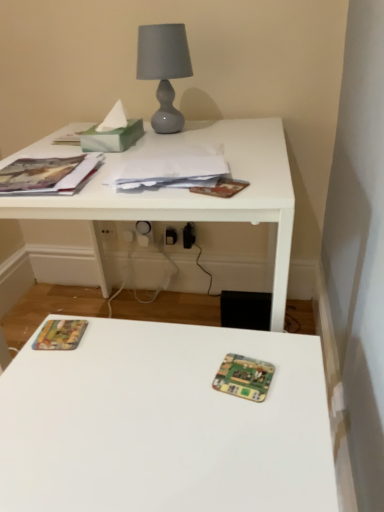
Question: Should I look upward or downward to see white glossy table at upper center?

Choices:
 (A) down
 (B) up

Answer: (A)

Question: Is the position of matte paper book at upper left, the second paperback book from the bottom, more distant than that of white glossy table at upper center?

Choices:
 (A) no
 (B) yes

Answer: (B)

Question: Is matte paper book at upper left, marked as the first paperback book in a top-to-bottom arrangement, oriented away from white glossy table at upper center?

Choices:
 (A) yes
 (B) no

Answer: (B)

Question: Is white glossy table at upper center surrounded by matte paper book at upper left, marked as the first paperback book in a top-to-bottom arrangement?

Choices:
 (A) no
 (B) yes

Answer: (A)

Question: From a real-world perspective, is matte paper book at upper left, marked as the first paperback book in a top-to-bottom arrangement, physically below white glossy table at upper center?

Choices:
 (A) no
 (B) yes

Answer: (A)

Question: Can you confirm if matte paper book at upper left, marked as the first paperback book in a top-to-bottom arrangement, is bigger than white glossy table at upper center?

Choices:
 (A) no
 (B) yes

Answer: (A)

Question: From a real-world perspective, is matte paper book at upper left, marked as the first paperback book in a top-to-bottom arrangement, physically above white glossy table at upper center?

Choices:
 (A) no
 (B) yes

Answer: (B)

Question: Is matte gray glass table lamp at upper center smaller than white paper at center?

Choices:
 (A) no
 (B) yes

Answer: (A)

Question: Does matte gray glass table lamp at upper center have a greater width compared to white paper at center?

Choices:
 (A) yes
 (B) no

Answer: (B)

Question: Considering the relative sizes of matte gray glass table lamp at upper center and white paper at center in the image provided, is matte gray glass table lamp at upper center shorter than white paper at center?

Choices:
 (A) no
 (B) yes

Answer: (A)

Question: Is matte gray glass table lamp at upper center aimed at white paper at center?

Choices:
 (A) no
 (B) yes

Answer: (B)

Question: Is white paper at center inside matte gray glass table lamp at upper center?

Choices:
 (A) yes
 (B) no

Answer: (B)

Question: Considering the relative positions of matte gray glass table lamp at upper center and white paper at center in the image provided, is matte gray glass table lamp at upper center to the left of white paper at center from the viewer's perspective?

Choices:
 (A) yes
 (B) no

Answer: (A)

Question: Is there a large distance between green marbled tissue at upper left and matte gray glass table lamp at upper center?

Choices:
 (A) no
 (B) yes

Answer: (A)